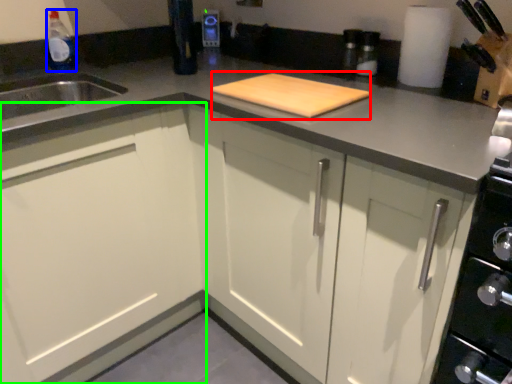
Question: Considering the real-world distances, which object is farthest from cutting board (highlighted by a red box)? bottle (highlighted by a blue box) or cabinetry (highlighted by a green box)?

Choices:
 (A) bottle
 (B) cabinetry

Answer: (A)